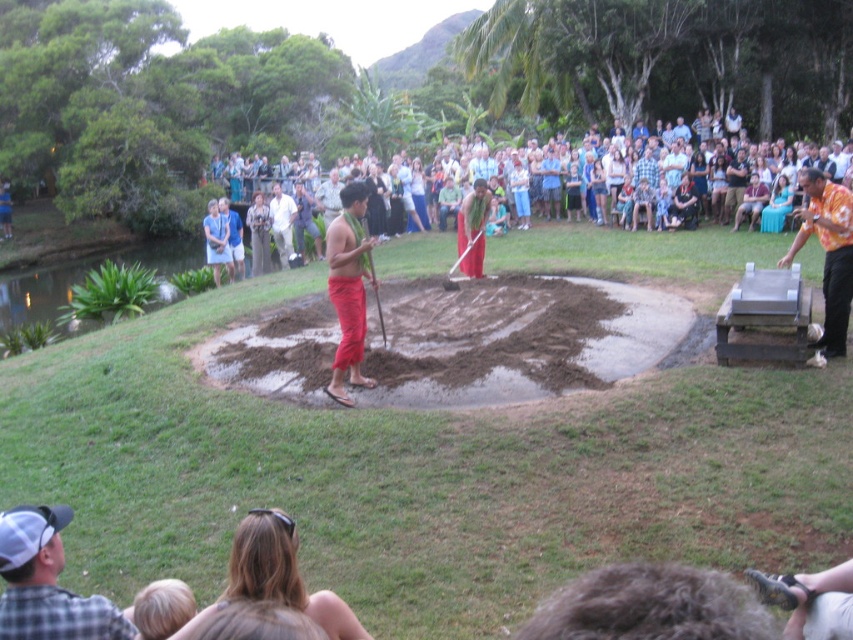
You are a photographer standing at the center of the scene. You want to take a photo of the orange printed shirt at right and ensure that it is in focus while keeping the two individuals in traditional attire in the background. Can you do this with a standard camera lens that has a maximum aperture of f1.4?

Yes, because the orange printed shirt at right is 8.81 meters away from the photographer, which allows for a shallow depth of field at f1.4 to keep the foreground subject sharp while blurring the background.

You are standing at the event and want to take a photo of the point marked at coordinate (39, 534). If you are 11.64 feet away from it, is that a good distance for a clear photo?

The point at coordinate (39, 534) is 11.64 feet away from you. This distance should allow for a clear photo, as it provides enough space to capture the subject without being too close or too far.

You are standing at the center of the event and want to move towards the two points marked in the image. Which point, point [271,204] or point [674,212], is closer to you?

Point [271,204] is closer to the viewer than point [674,212], so you should move towards point [271,204] first.